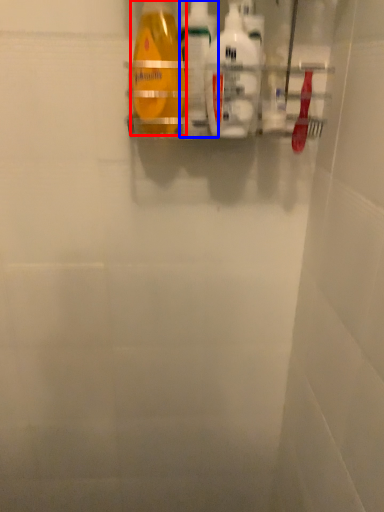
Question: Which object appears farthest to the camera in this image, bottle (highlighted by a red box) or cleaning product (highlighted by a blue box)?

Choices:
 (A) bottle
 (B) cleaning product

Answer: (B)